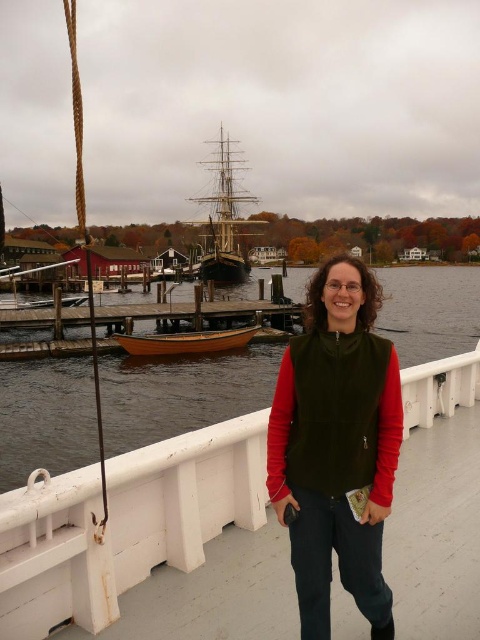
You are standing on the ship and want to place a large box on the white wooden deck at center. However, you also need to wear the green fleece vest at center. Can you fit the box on the deck while wearing the vest?

The white wooden deck at center occupies less space than the green fleece vest at center. Therefore, the deck may not have enough space to accommodate the large box while wearing the vest, as the vest takes up more area.

You are standing on the ship and want to place a small item on the white wooden deck at center. Since the green fleece vest at center is in the way, will you need to move it to access the deck?

The white wooden deck at center is located below the green fleece vest at center, so you will need to move the green fleece vest at center to access the deck.